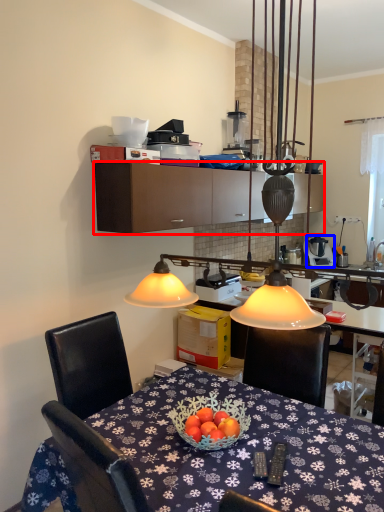
Question: Which point is further to the camera, cabinetry (highlighted by a red box) or appliance (highlighted by a blue box)?

Choices:
 (A) cabinetry
 (B) appliance

Answer: (B)